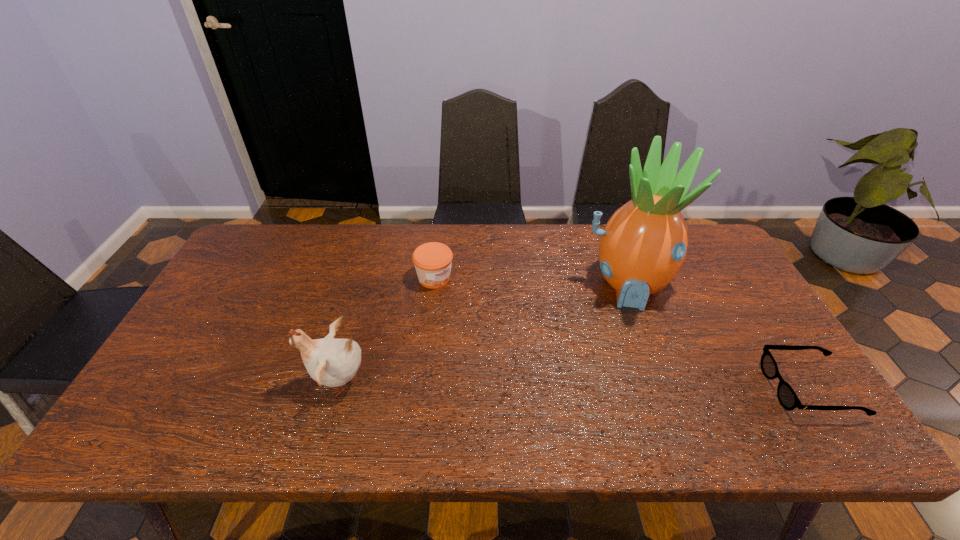
At what (x,y) coordinates should I click in order to perform the action: click on jam located at the far edge. Please return your answer as a coordinate pair (x, y). Looking at the image, I should click on (432, 260).

Where is `pineapple positioned at the far edge`? This screenshot has height=540, width=960. pineapple positioned at the far edge is located at coordinates (643, 246).

Where is `bird that is at the near edge`? bird that is at the near edge is located at coordinates (331, 362).

Where is `spectacles that is at the near edge`? Image resolution: width=960 pixels, height=540 pixels. spectacles that is at the near edge is located at coordinates (788, 399).

What are the coordinates of `object at the right edge` in the screenshot? It's located at (788, 399).

Where is `object at the near right corner`? This screenshot has height=540, width=960. object at the near right corner is located at coordinates (788, 399).

Where is `free space at the far edge of the desktop`? This screenshot has width=960, height=540. free space at the far edge of the desktop is located at coordinates (549, 228).

The image size is (960, 540). Find the location of `vacant space at the near edge of the desktop`. vacant space at the near edge of the desktop is located at coordinates (520, 397).

I want to click on vacant space at the left edge of the desktop, so click(218, 330).

Find the location of a particular element. This screenshot has width=960, height=540. vacant point at the right edge is located at coordinates (721, 289).